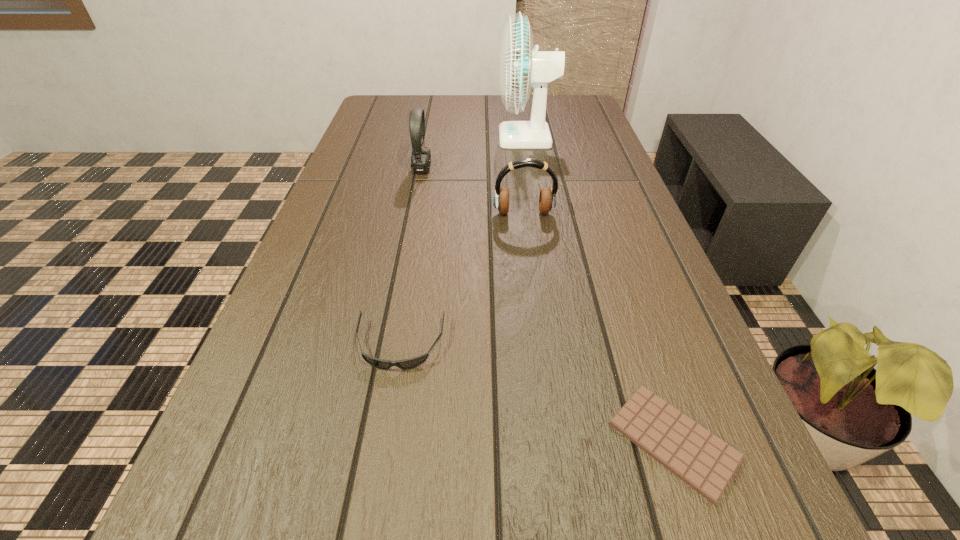
In the image, there is a desktop. What are the coordinates of `vacant space at the right edge` in the screenshot? It's located at (617, 170).

At what (x,y) coordinates should I click in order to perform the action: click on vacant space in between the nearest object and the fan. Please return your answer as a coordinate pair (x, y). Looking at the image, I should click on (600, 289).

Locate an element on the screen. Image resolution: width=960 pixels, height=540 pixels. free space between the fourth tallest object and the nearer headset is located at coordinates (462, 279).

Find the location of `unoccupied area between the fan and the sunglasses`. unoccupied area between the fan and the sunglasses is located at coordinates (463, 241).

You are a GUI agent. You are given a task and a screenshot of the screen. Output one action in this format:
    pyautogui.click(x=<x>, y=<y>)
    Task: Click on the vacant space that's between the sunglasses and the shorter headset
    This screenshot has height=540, width=960.
    Given the screenshot: What is the action you would take?
    pyautogui.click(x=462, y=279)

The height and width of the screenshot is (540, 960). In order to click on empty location between the farther headset and the second shortest object in this screenshot , I will do `click(411, 256)`.

The height and width of the screenshot is (540, 960). In order to click on vacant space in between the fan and the farther headset in this screenshot , I will do [x=474, y=153].

Identify the location of blank region between the tallest object and the shorter headset. (525, 176).

Identify the location of vacant region between the left headset and the tallest object. This screenshot has width=960, height=540. (474, 153).

Locate an element on the screen. Image resolution: width=960 pixels, height=540 pixels. free space between the fan and the sunglasses is located at coordinates (463, 241).